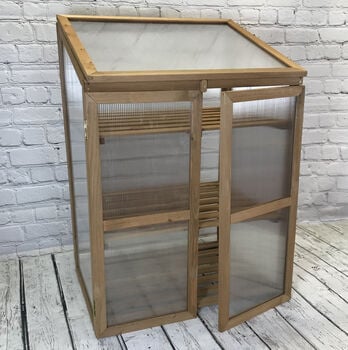
Where is `glass top`? This screenshot has width=348, height=350. glass top is located at coordinates (185, 42).